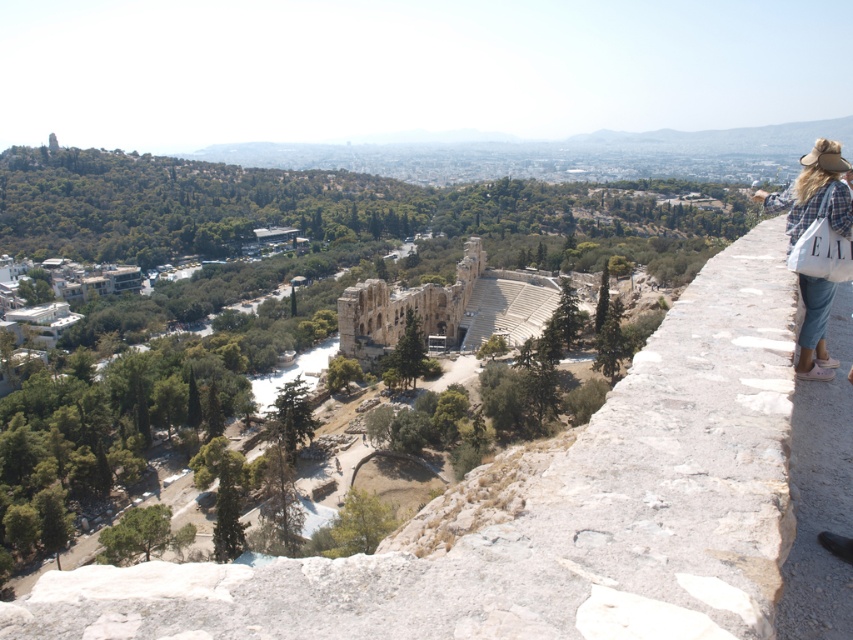
Question: From the image, what is the correct spatial relationship of beige stone amphitheater at center in relation to blue denim jeans at right?

Choices:
 (A) below
 (B) above

Answer: (A)

Question: Does beige stone amphitheater at center come behind blue denim jeans at right?

Choices:
 (A) yes
 (B) no

Answer: (A)

Question: Which point appears farthest from the camera in this image?

Choices:
 (A) (386, 326)
 (B) (799, 202)

Answer: (A)

Question: Among these objects, which one is farthest from the camera?

Choices:
 (A) blue denim jeans at right
 (B) beige stone amphitheater at center

Answer: (B)

Question: Among these points, which one is nearest to the camera?

Choices:
 (A) (349, 308)
 (B) (810, 221)

Answer: (B)

Question: In this image, where is beige stone amphitheater at center located relative to blue denim jeans at right?

Choices:
 (A) below
 (B) above

Answer: (A)